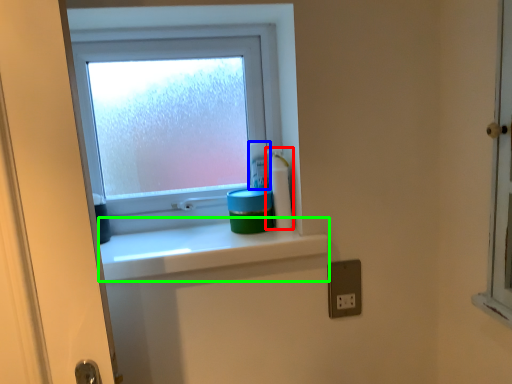
Question: Considering the real-world distances, which object is closest to cleaning product (highlighted by a red box)? toiletry (highlighted by a blue box) or window sill (highlighted by a green box).

Choices:
 (A) toiletry
 (B) window sill

Answer: (A)